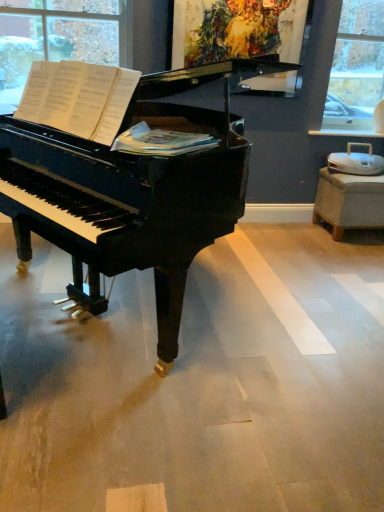
Locate an element on the screen. free region under glossy black piano at center (from a real-world perspective) is located at coordinates (137, 302).